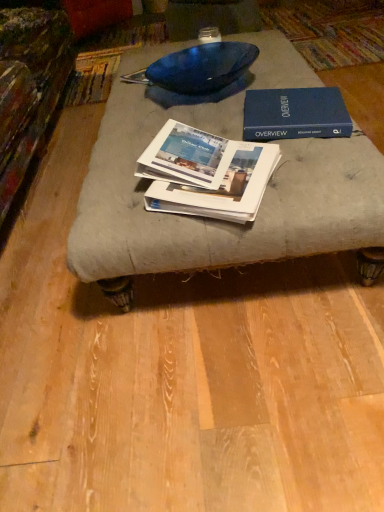
This screenshot has width=384, height=512. Identify the location of blank area beneath white paper booklet at center, which is the second book in top-to-bottom order (from a real-world perspective). (213, 160).